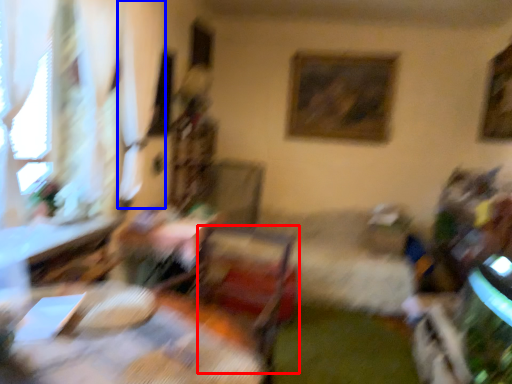
Question: Which of the following is the farthest to the observer, swivel chair (highlighted by a red box) or curtain (highlighted by a blue box)?

Choices:
 (A) swivel chair
 (B) curtain

Answer: (B)